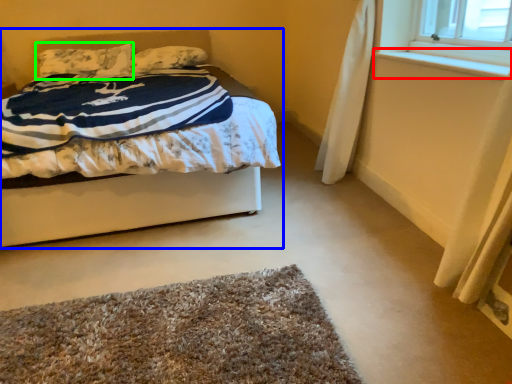
Question: Based on their relative distances, which object is farther from window sill (highlighted by a red box)? Choose from bed (highlighted by a blue box) and pillow (highlighted by a green box).

Choices:
 (A) bed
 (B) pillow

Answer: (B)